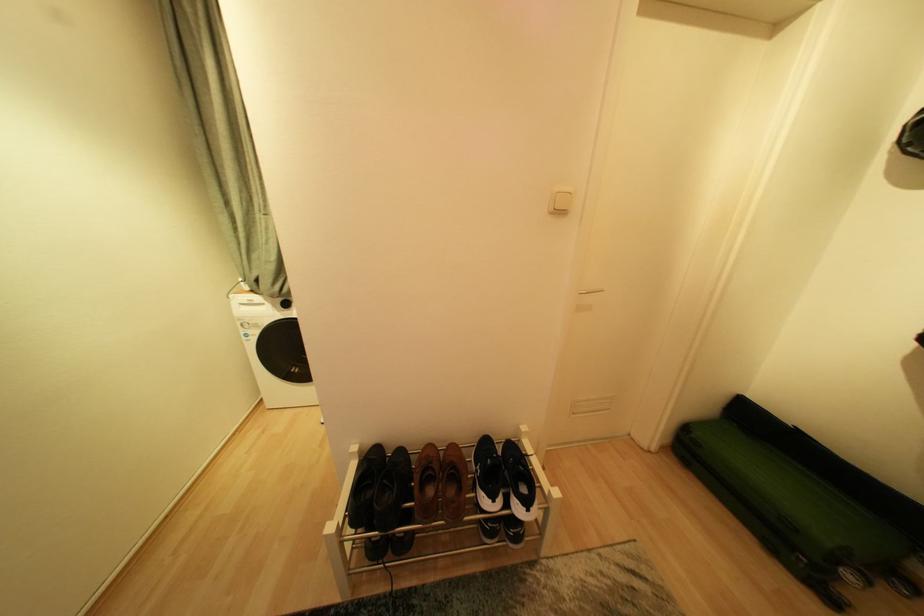
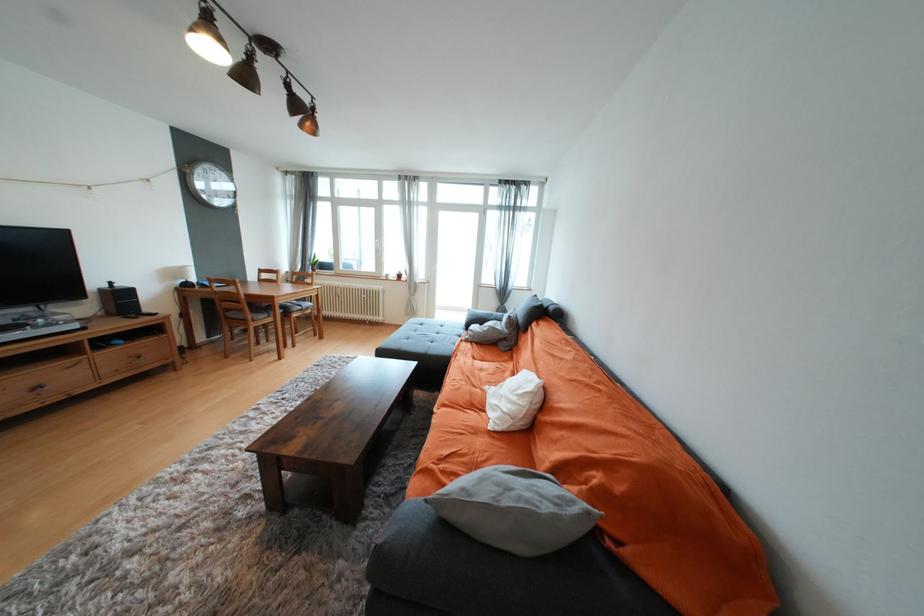
Question: Which direction would the cameraman need to move to produce the second image? Reply with the corresponding letter.

Choices:
 (A) Left
 (B) Right
 (C) Forward
 (D) Backward

Answer: (A)